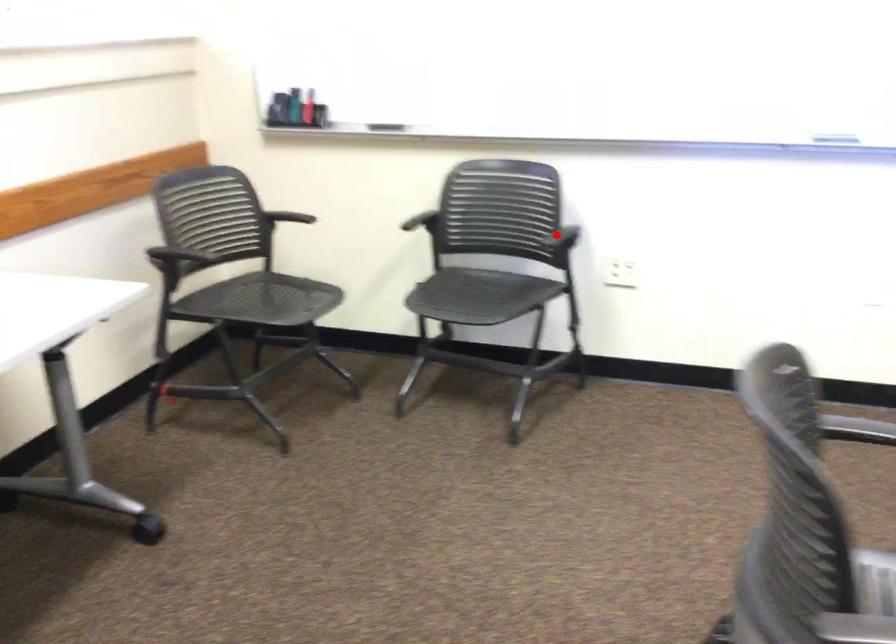
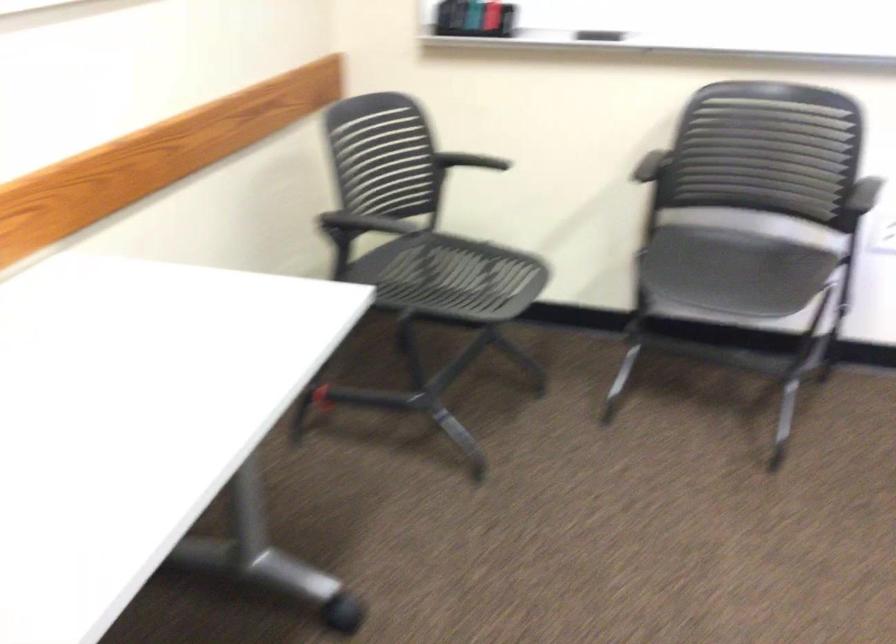
The point at the highlighted location is marked in the first image. Where is the corresponding point in the second image?

(865, 194)